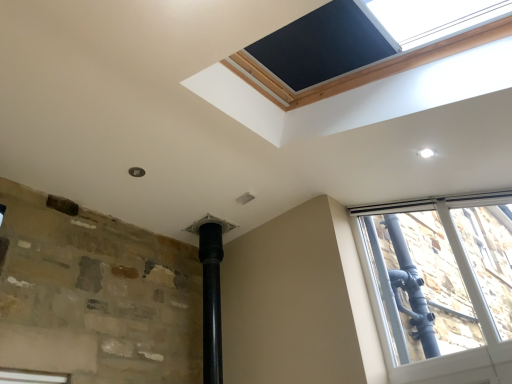
Locate an element on the screen. The width and height of the screenshot is (512, 384). black matte window screen at upper center is located at coordinates (323, 45).

Measure the distance between black matte window screen at upper center and camera.

black matte window screen at upper center and camera are 1.74 meters apart from each other.

Measure the distance between point (330, 64) and camera.

A distance of 2.14 meters exists between point (330, 64) and camera.

In order to face black matte window screen at upper center, should I rotate leftwards or rightwards?

Turn right approximately 6.952 degrees to face it.

What do you see at coordinates (323, 45) in the screenshot? I see `black matte window screen at upper center` at bounding box center [323, 45].

Find the location of a particular element. The width and height of the screenshot is (512, 384). clear glass window at upper right is located at coordinates [x=441, y=285].

Describe the element at coordinates (441, 285) in the screenshot. I see `clear glass window at upper right` at that location.

Locate an element on the screen. This screenshot has width=512, height=384. black matte window screen at upper center is located at coordinates (323, 45).

In the scene shown: Considering the positions of objects black matte window screen at upper center and clear glass window at upper right in the image provided, who is more to the right, black matte window screen at upper center or clear glass window at upper right?

From the viewer's perspective, clear glass window at upper right appears more on the right side.

Which object is further away from the camera taking this photo, black matte window screen at upper center or clear glass window at upper right?

Positioned behind is clear glass window at upper right.

Is point (385, 36) closer to viewer compared to point (386, 304)?

Yes, it is.

From the image's perspective, is black matte window screen at upper center over clear glass window at upper right?

Yes, from the image's perspective, black matte window screen at upper center is on top of clear glass window at upper right.

From a real-world perspective, is black matte window screen at upper center under clear glass window at upper right?

No.

Is black matte window screen at upper center wider than clear glass window at upper right?

Indeed, black matte window screen at upper center has a greater width compared to clear glass window at upper right.

Considering the sizes of objects black matte window screen at upper center and clear glass window at upper right in the image provided, who is shorter, black matte window screen at upper center or clear glass window at upper right?

black matte window screen at upper center is shorter.

Looking at the image, does black matte window screen at upper center seem bigger or smaller compared to clear glass window at upper right?

In the image, black matte window screen at upper center appears to be smaller than clear glass window at upper right.

Can we say black matte window screen at upper center lies outside clear glass window at upper right?

Yes, black matte window screen at upper center is outside of clear glass window at upper right.

Is black matte window screen at upper center positioned far away from clear glass window at upper right?

That's right, there is a large distance between black matte window screen at upper center and clear glass window at upper right.

Could you tell me if black matte window screen at upper center is facing clear glass window at upper right?

No, black matte window screen at upper center is not oriented towards clear glass window at upper right.

How many degrees apart are the facing directions of black matte window screen at upper center and clear glass window at upper right?

There is a 90.2-degree angle between the facing directions of black matte window screen at upper center and clear glass window at upper right.

The image size is (512, 384). What are the coordinates of `window screen above the clear glass window at upper right (from the image's perspective)` in the screenshot? It's located at (323, 45).

Based on their positions, is clear glass window at upper right located to the left or right of black matte window screen at upper center?

Based on their positions, clear glass window at upper right is located to the right of black matte window screen at upper center.

Does clear glass window at upper right lie in front of black matte window screen at upper center?

No, clear glass window at upper right is behind black matte window screen at upper center.

Which is farther from the camera, (435, 282) or (311, 52)?

The point (435, 282) is farther from the camera.

From the image's perspective, is clear glass window at upper right located above or below black matte window screen at upper center?

Based on their image positions, clear glass window at upper right is located beneath black matte window screen at upper center.

From a real-world perspective, relative to black matte window screen at upper center, is clear glass window at upper right vertically above or below?

clear glass window at upper right is situated lower than black matte window screen at upper center in the real world.

Which of these two, clear glass window at upper right or black matte window screen at upper center, is wider?

With larger width is black matte window screen at upper center.

Considering the sizes of objects clear glass window at upper right and black matte window screen at upper center in the image provided, who is shorter, clear glass window at upper right or black matte window screen at upper center?

With less height is black matte window screen at upper center.

Between clear glass window at upper right and black matte window screen at upper center, which one has smaller size?

black matte window screen at upper center is smaller.

Is clear glass window at upper right inside or outside of black matte window screen at upper center?

clear glass window at upper right is not inside black matte window screen at upper center, it's outside.

Is clear glass window at upper right positioned far away from black matte window screen at upper center?

Yes, clear glass window at upper right and black matte window screen at upper center are quite far apart.

Could you tell me if clear glass window at upper right is turned towards black matte window screen at upper center?

Yes.

Looking at this image, what's the angular difference between clear glass window at upper right and black matte window screen at upper center's facing directions?

The facing directions of clear glass window at upper right and black matte window screen at upper center are 90.2 degrees apart.

This screenshot has height=384, width=512. I want to click on window below the black matte window screen at upper center (from the image's perspective), so click(441, 285).

The image size is (512, 384). There is a clear glass window at upper right. Identify the location of window screen above it (from a real-world perspective). (323, 45).

Find the location of a particular element. window behind the black matte window screen at upper center is located at coordinates (441, 285).